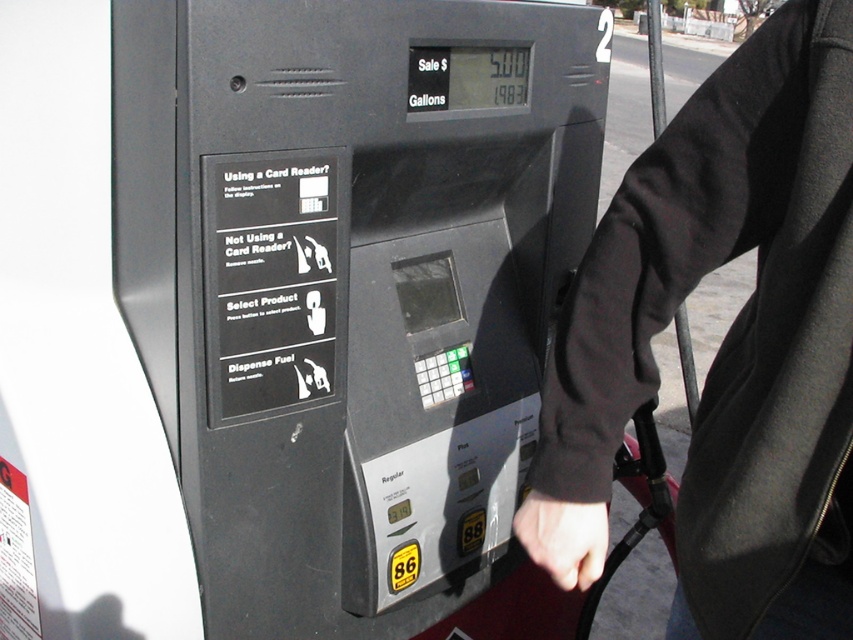
Which is behind, point (410, 602) or point (740, 52)?

The point (410, 602) is behind.

Can you confirm if black plastic gas pump at center is smaller than black fabric sleeve at upper right?

Incorrect, black plastic gas pump at center is not smaller in size than black fabric sleeve at upper right.

Between point (357, 221) and point (637, 179), which one is positioned in front?

Positioned in front is point (637, 179).

Image resolution: width=853 pixels, height=640 pixels. I want to click on black plastic gas pump at center, so click(352, 289).